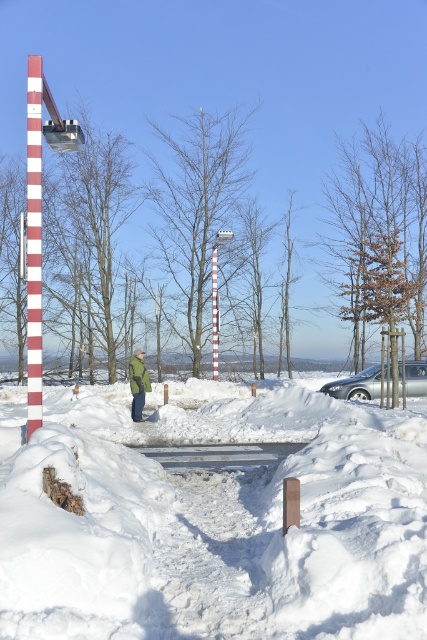
You are standing at the snow covered road and want to reach the point closer to you. Which of the two points, point (40, 365) or point (131, 384), should you head towards?

Point (40, 365) is closer to the viewer than point (131, 384), so you should head towards point (40, 365).

You are a delivery driver who needs to park your silver metallic car at right next to the red striped pole at center. Based on the scene, can your car fit next to the pole without overlapping it?

The silver metallic car at right is wider than the red striped pole at center. Since the car is wider, it can fit next to the pole without overlapping as long as there is enough space along the road.

You are a pedestrian standing at the snowy road. You see the white striped pole at center and the green matte jacket at center. Which object is closer to you?

The white striped pole at center is closer to you because it is in front of the green matte jacket at center.